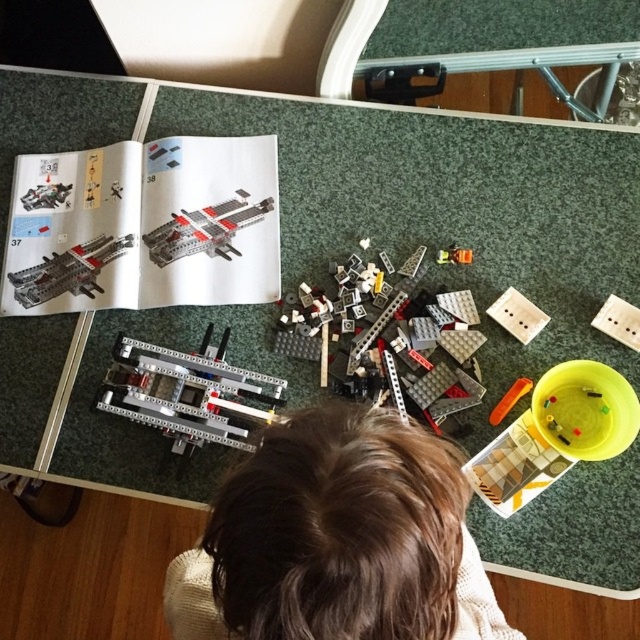
You are a person with a brown hair at center trying to place a matte black spaceship at upper left on your head. Will the spaceship fit over your hair?

The brown hair at center is wider than the matte black spaceship at upper left, so the spaceship may not fit over your hair as it is narrower than the hair itself.

You are a LEGO assembler who needs to place the matte black plastic space shuttle at upper left onto the white plastic plate at upper right. Based on the scene description, can you do this action without moving any other objects on the table?

The matte black plastic space shuttle at upper left is located above the white plastic plate at upper right, so you can place it directly onto the plate without needing to move other objects.

You are looking at the table where the LEGO set is being assembled. There are two points marked on the table surface, point (172, 394) and point (113, 241). Which of these two points is closer to you?

Point (172, 394) is closer to the camera than point (113, 241), so point (172, 394) is closer to you.